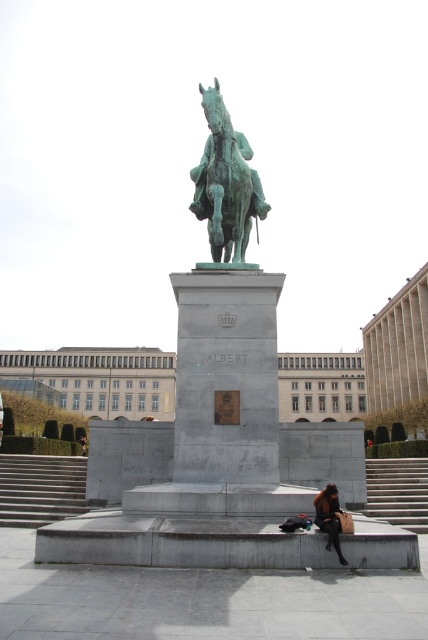
You are standing in front of the equestrian statue of ALBERT. You need to climb up to the base to read the inscription. Which set of stairs should you use? The gray concrete stairs at lower left or the concrete stairs at lower right?

You should use the concrete stairs at lower right because the gray concrete stairs at lower left is below it, meaning the concrete stairs at lower right is higher and closer to the base of the statue.

From the picture: You are standing in the public square and want to take a photo of the green patina statue at center and the concrete stairs at lower right. If you position yourself so that both are visible in your camera frame, which object will appear on the left side of the photo?

The green patina statue at center will appear on the left side of the photo because it is positioned to the left of the concrete stairs at lower right.

In the scene shown: You are standing in front of the equestrian statue of Albert. You want to take a photo of the statue from a distance that allows you to capture the entire structure, including the base and the seated person on the concrete stairs at lower right. Based on the description, what is the minimum distance you should be from the statue to ensure the entire scene is in frame?

The concrete stairs at lower right is 45.24 feet from camera. To capture the entire scene including the statue base and the seated person on the concrete stairs at lower right, you should position yourself at least 45.24 feet away from the statue.